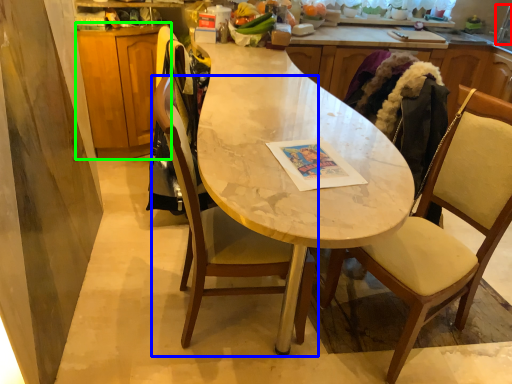
Question: Which object is the farthest from faucet (highlighted by a red box)? Choose among these: chair (highlighted by a blue box) or cabinetry (highlighted by a green box).

Choices:
 (A) chair
 (B) cabinetry

Answer: (B)